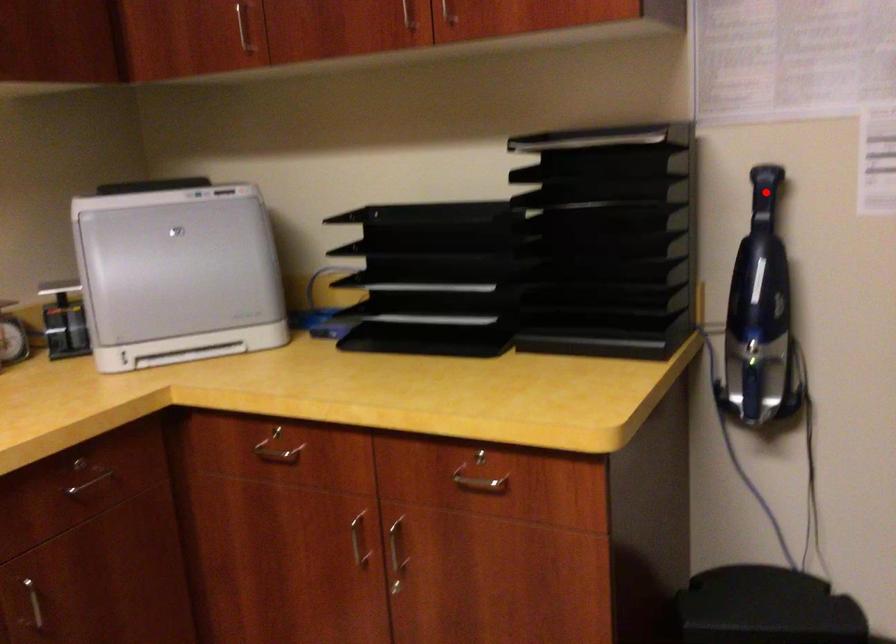
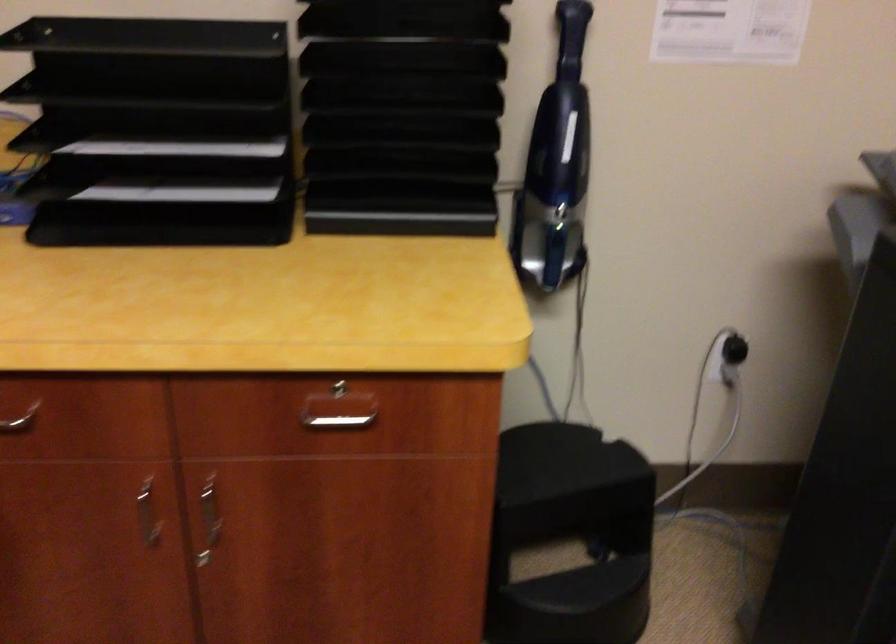
Where in the second image is the point corresponding to the highlighted location from the first image?

(571, 37)